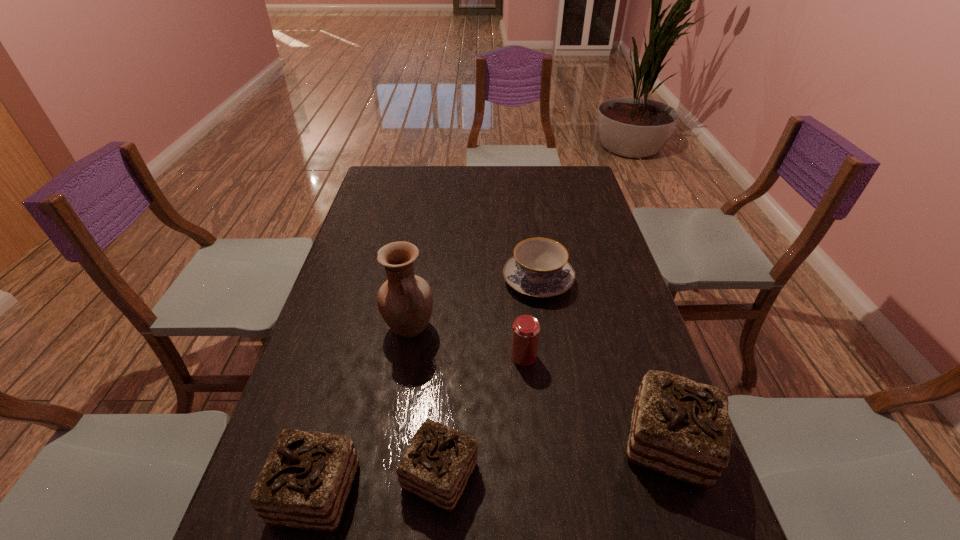
Locate an element on the screen. The image size is (960, 540). the leftmost chocolate cake is located at coordinates (305, 483).

In order to click on the shortest chocolate cake in this screenshot , I will do `click(439, 461)`.

The width and height of the screenshot is (960, 540). What are the coordinates of `the rightmost object` in the screenshot? It's located at (680, 428).

Where is `pottery`? This screenshot has width=960, height=540. pottery is located at coordinates (405, 301).

I want to click on beer can, so click(525, 335).

Find the location of a particular element. This screenshot has height=540, width=960. chinaware is located at coordinates (539, 268).

You are a GUI agent. You are given a task and a screenshot of the screen. Output one action in this format:
    pyautogui.click(x=<x>, y=<y>)
    Task: Click on the vacant space located on the right of the second tallest chocolate cake
    
    Given the screenshot: What is the action you would take?
    pyautogui.click(x=482, y=492)

Where is `vacant space located 0.380m on the right of the shortest chocolate cake`? This screenshot has width=960, height=540. vacant space located 0.380m on the right of the shortest chocolate cake is located at coordinates (663, 475).

Where is `free space located 0.210m on the back of the rightmost object`? Image resolution: width=960 pixels, height=540 pixels. free space located 0.210m on the back of the rightmost object is located at coordinates (631, 334).

Image resolution: width=960 pixels, height=540 pixels. Find the location of `free spot located 0.370m on the back of the tallest object`. free spot located 0.370m on the back of the tallest object is located at coordinates (424, 234).